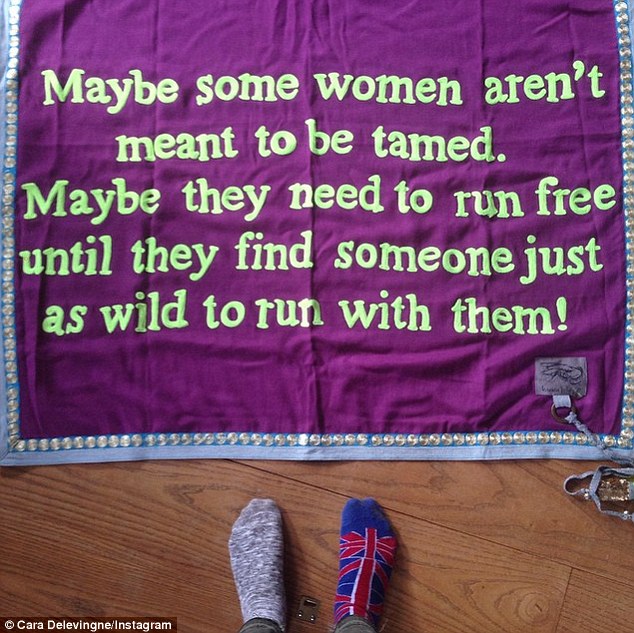
The height and width of the screenshot is (633, 634). Identify the location of wooden floor. (449, 520).